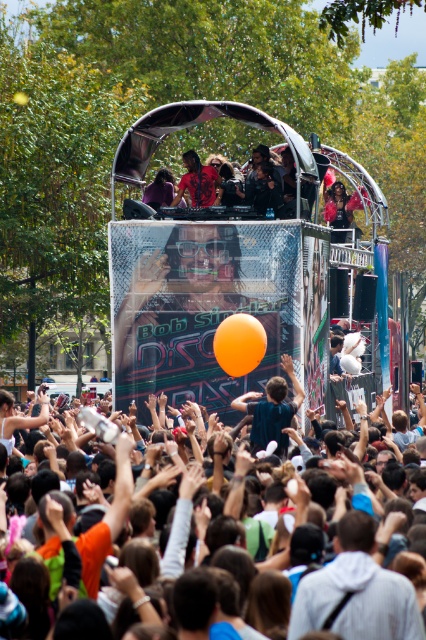
Looking at this image, does transparent glass decker bus at center have a larger size compared to matte orange balloon at center?

Yes, transparent glass decker bus at center is bigger than matte orange balloon at center.

Measure the distance between transparent glass decker bus at center and camera.

transparent glass decker bus at center is 298.43 feet from camera.

The height and width of the screenshot is (640, 426). I want to click on transparent glass decker bus at center, so click(x=215, y=305).

Can you confirm if transparent glass decker bus at center is positioned to the left of dark blue shirt at center?

No, transparent glass decker bus at center is not to the left of dark blue shirt at center.

Is transparent glass decker bus at center to the right of dark blue shirt at center from the viewer's perspective?

Correct, you'll find transparent glass decker bus at center to the right of dark blue shirt at center.

Identify the location of transparent glass decker bus at center. (215, 305).

Identify the location of transparent glass decker bus at center. Image resolution: width=426 pixels, height=640 pixels. (215, 305).

Locate an element on the screen. This screenshot has width=426, height=640. transparent glass decker bus at center is located at coordinates (215, 305).